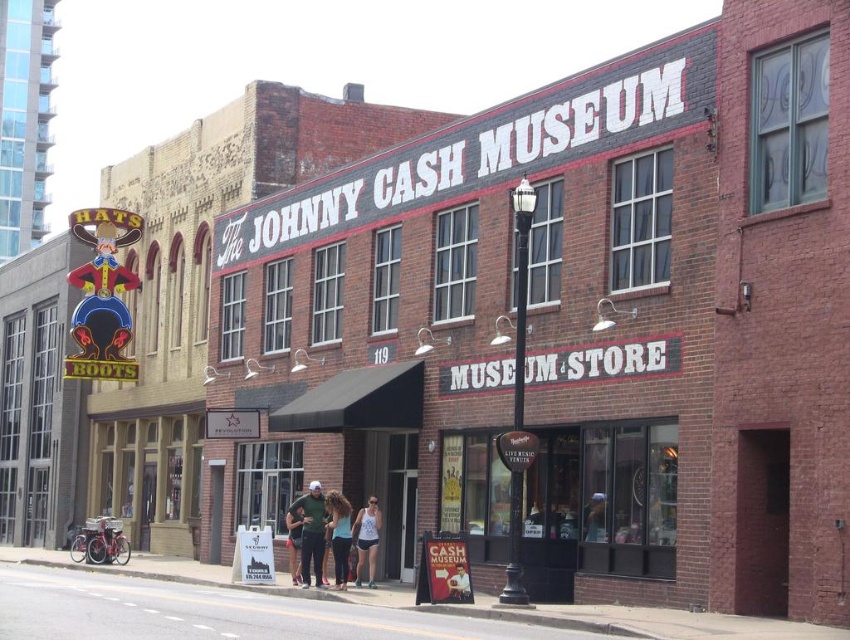
You are standing in front of the Johnny Cash Museum and notice two people wearing a green cotton shirt at center and matte blue shorts at center. Which clothing item is closer to you?

The green cotton shirt at center is closer to you because the matte blue shorts at center is behind it.

You are standing in front of the Johnny Cash Museum and want to see the display behind the matte glass window at center. However, there is a person wearing a green cotton shirt at center blocking your view. Can you look over their head to see the display?

The matte glass window at center is located above the green cotton shirt at center, so yes, you can look over the person wearing the green cotton shirt at center to see the display.